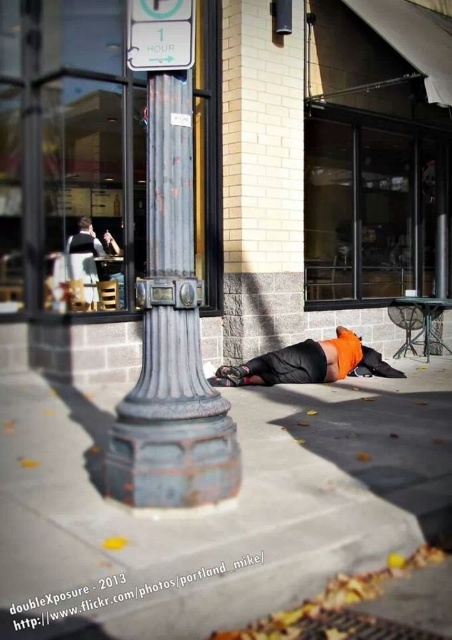
What is located at the coordinates point (320, 163) in the image?

At point (320, 163) lies brick wall at center.